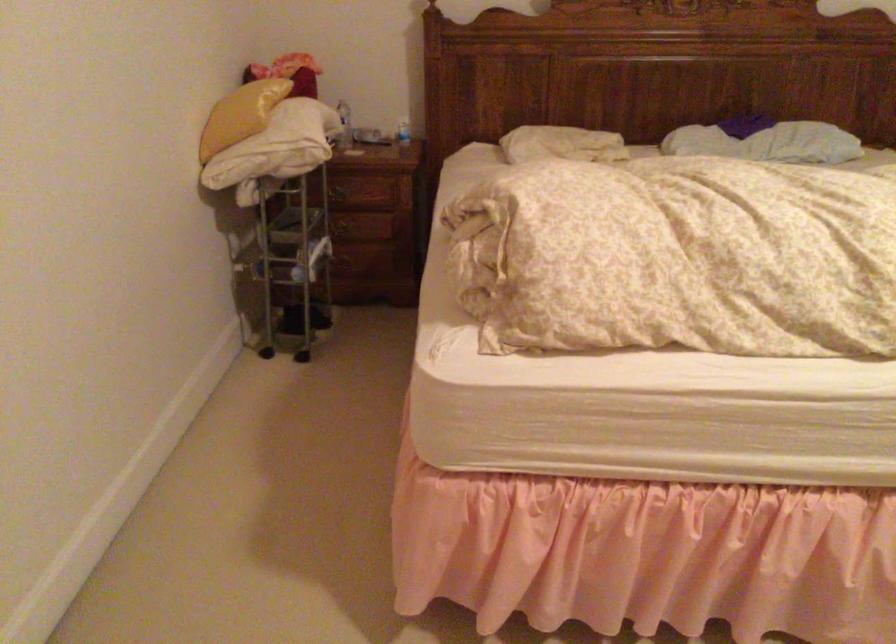
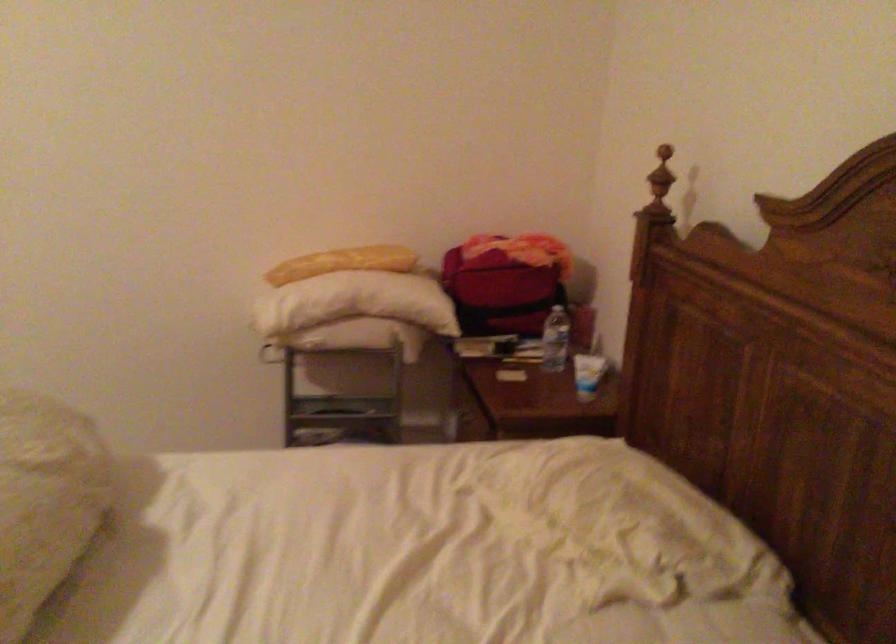
Find the pixel in the second image that matches point (363, 118) in the first image.

(556, 339)